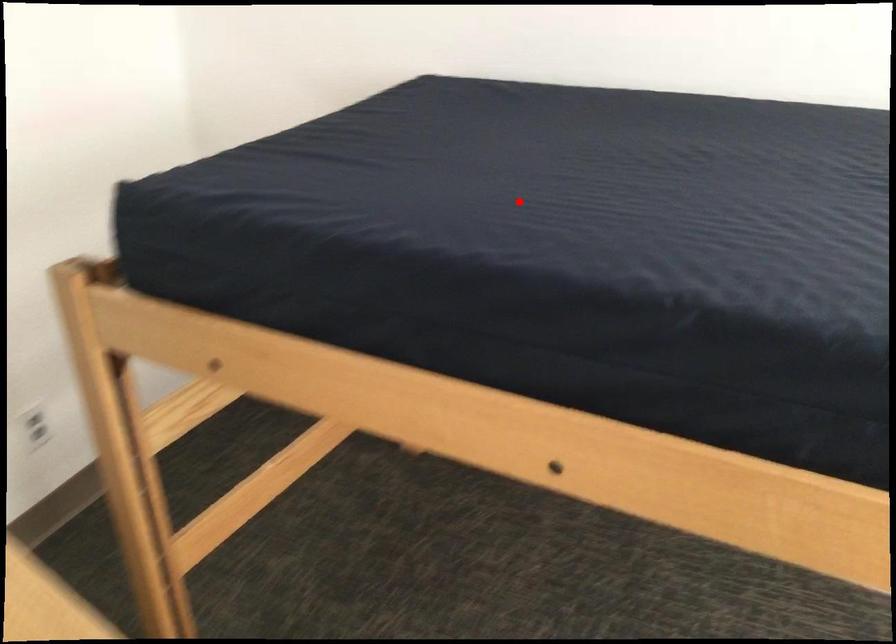
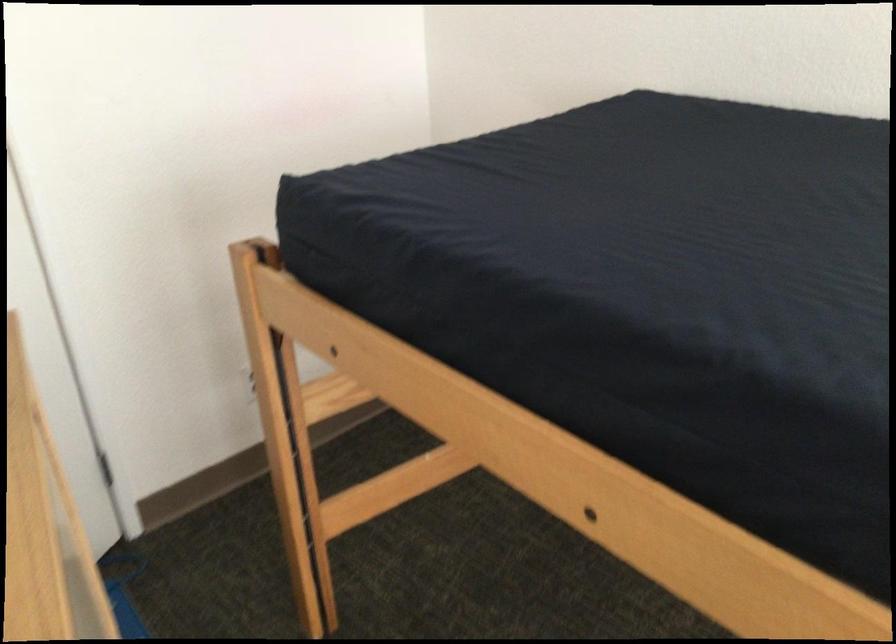
Find the pixel in the second image that matches the highlighted location in the first image.

(636, 228)